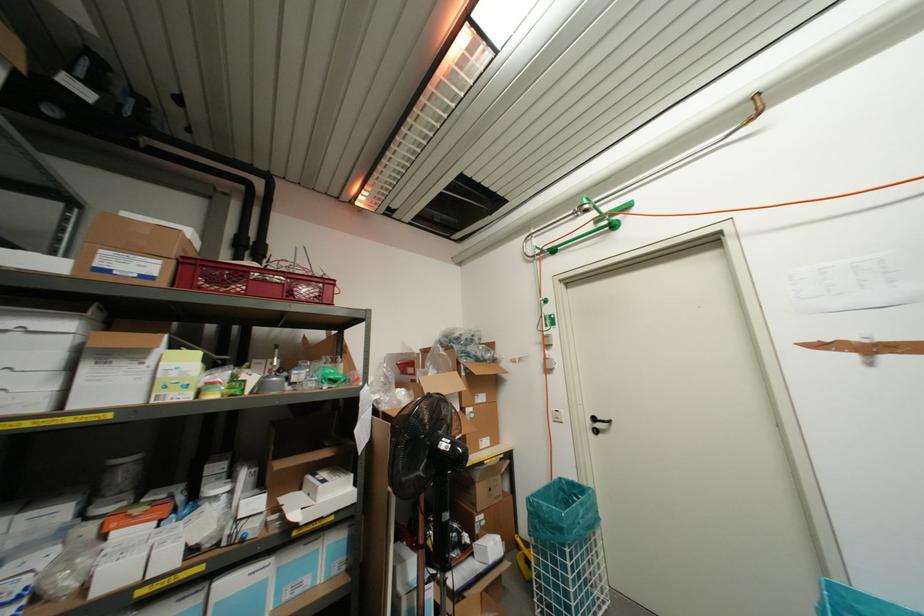
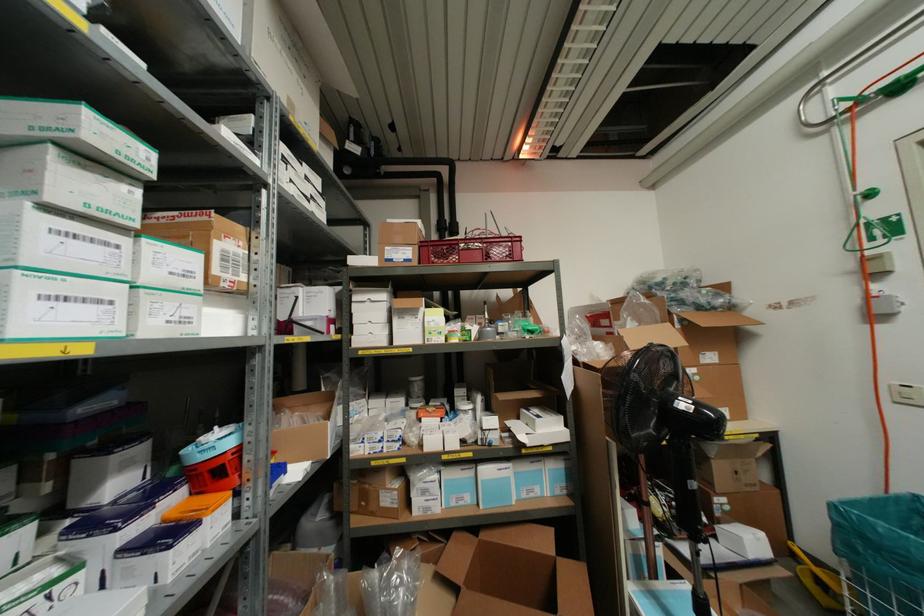
Where in the second image is the point corresponding to point (541, 252) from the first image?

(859, 100)